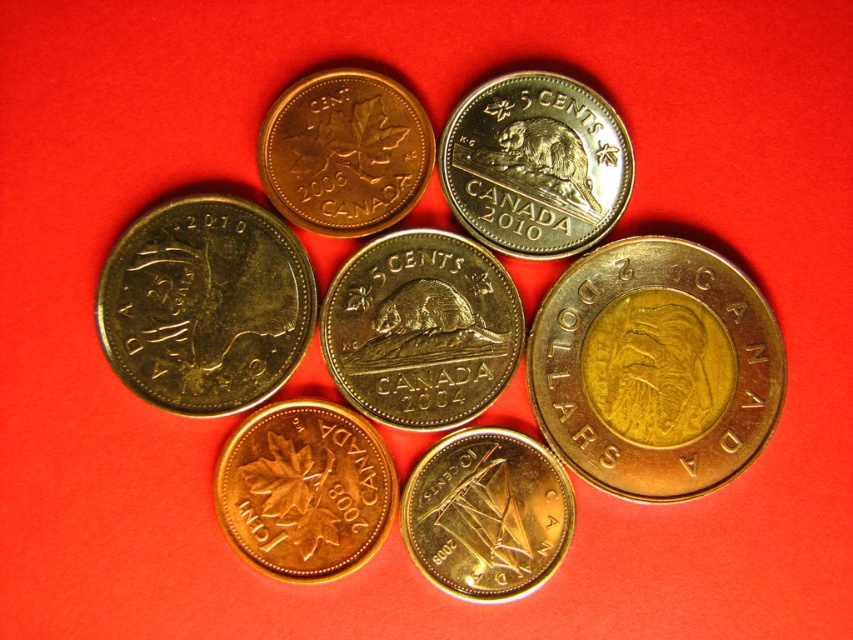
You are an appraiser assessing Canadian coins. You have two coins in front of you, the gold plated beaver at center and the gold plated maple leaf at center. Which coin is taller?

The gold plated beaver at center is taller than the gold plated maple leaf at center.

You are a coin collector who wants to display these coins in a case. Given the gold plated eagle at center and the gold plated maple leaf at center, which coin should you place in a larger compartment to accommodate its size?

The gold plated eagle at center should be placed in a larger compartment because its width is greater than the gold plated maple leaf at center.